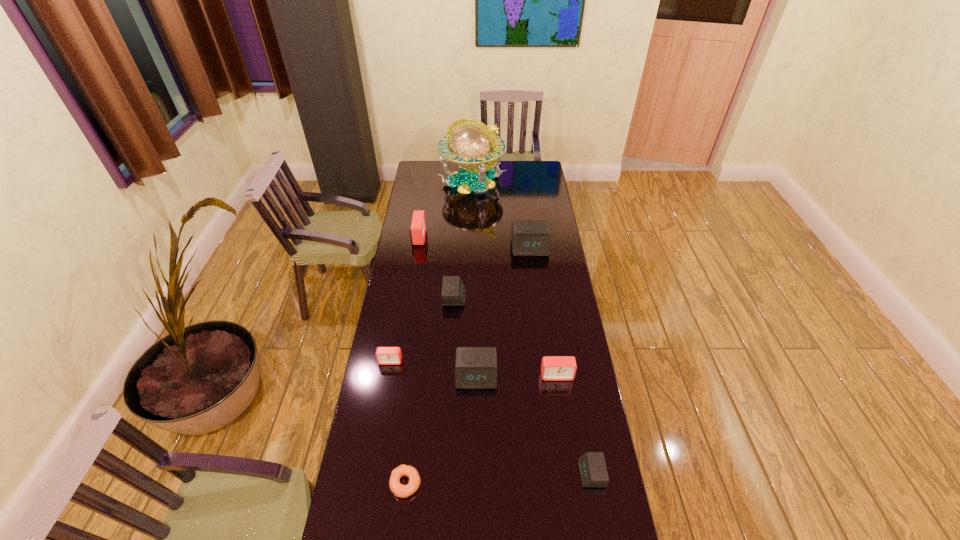
This screenshot has width=960, height=540. Find the location of `vacant area between the fifth nearest alarm clock and the tallest object`. vacant area between the fifth nearest alarm clock and the tallest object is located at coordinates (464, 239).

Where is `the sixth closest object relative to the biggest red alarm clock`? This screenshot has height=540, width=960. the sixth closest object relative to the biggest red alarm clock is located at coordinates (553, 368).

Find the location of `object that is the eighth closest to the biggest red alarm clock`. object that is the eighth closest to the biggest red alarm clock is located at coordinates (592, 466).

You are a GUI agent. You are given a task and a screenshot of the screen. Output one action in this format:
    pyautogui.click(x=<x>, y=<y>)
    Task: Click on the third closest alarm clock relative to the third farthest black alarm clock
    
    Given the screenshot: What is the action you would take?
    coord(453,290)

Locate which alarm clock is the sixth closest to the globe. Please provide its 2D coordinates. Your answer should be formatted as a tuple, i.e. [(x, y)], where the tuple contains the x and y coordinates of a point satisfying the conditions above.

[(553, 368)]

This screenshot has width=960, height=540. Identify the location of red alarm clock object that ranks as the second closest to the smallest red alarm clock. (417, 230).

Identify the location of red alarm clock identified as the closest to the nearest red alarm clock. (384, 355).

Locate an element on the screen. The width and height of the screenshot is (960, 540). black alarm clock object that ranks as the third closest to the tallest object is located at coordinates (475, 367).

Identify the location of black alarm clock that is the fourth closest one to the second farthest red alarm clock. (529, 237).

Find the location of a particular element. The image size is (960, 540). free location that satisfies the following two spatial constraints: 1. on the front-facing side of the biggest black alarm clock; 2. on the front-facing side of the fourth farthest object is located at coordinates (536, 297).